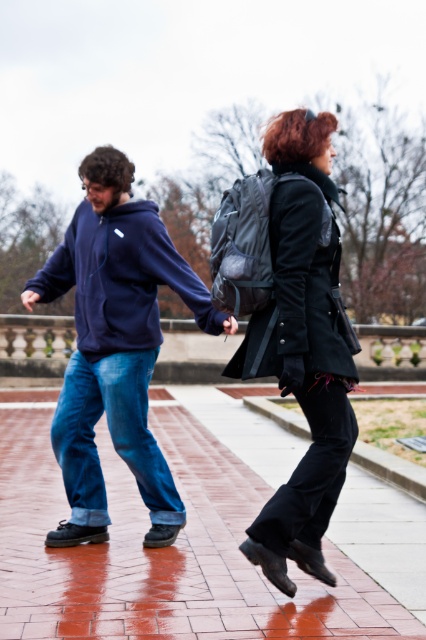
You are a photographer trying to capture a candid shot of the two people in the scene. You want to frame the shot so that the matte black coat at center and the navy fleece jacket at left are both visible. Which direction should you position yourself relative to the pair to ensure both are in the frame?

To ensure both the matte black coat at center and the navy fleece jacket at left are in the frame, position yourself to the left of the pair. Since the matte black coat at center is to the right of the navy fleece jacket at left, positioning yourself to the left will allow you to see both individuals side by side without one blocking the other.

You are a fashion designer observing the two individuals in the image. You need to recommend a size for their outfits based on the clothing sizes visible. Which of the two outfits, the matte blue hoodie at center or the matte black coat at center, would require a larger size recommendation?

The matte blue hoodie at center is larger in size than the matte black coat at center, so the matte blue hoodie at center would require a larger size recommendation.